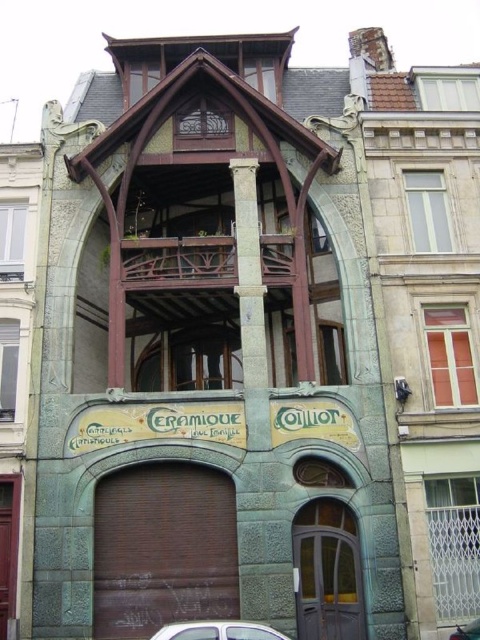
Does point (230, 561) lie behind point (233, 625)?

Yes, point (230, 561) is behind point (233, 625).

Which is more to the right, brown matte door at center or silver metallic car at lower center?

silver metallic car at lower center

Describe the element at coordinates (163, 548) in the screenshot. Image resolution: width=480 pixels, height=640 pixels. I see `brown matte door at center` at that location.

Find the location of a particular element. The image size is (480, 640). brown matte door at center is located at coordinates (163, 548).

Looking at this image, does green stone door at lower left have a smaller size compared to metallic silver car at lower right?

No.

Between point (3, 621) and point (462, 627), which one is positioned in front?

Positioned in front is point (462, 627).

Identify the location of green stone door at lower left. This screenshot has width=480, height=640. (8, 547).

Between green stone door at center and silver metallic car at lower center, which one is positioned higher?

green stone door at center is higher up.

This screenshot has height=640, width=480. Describe the element at coordinates (327, 572) in the screenshot. I see `green stone door at center` at that location.

Identify the location of green stone door at center. (327, 572).